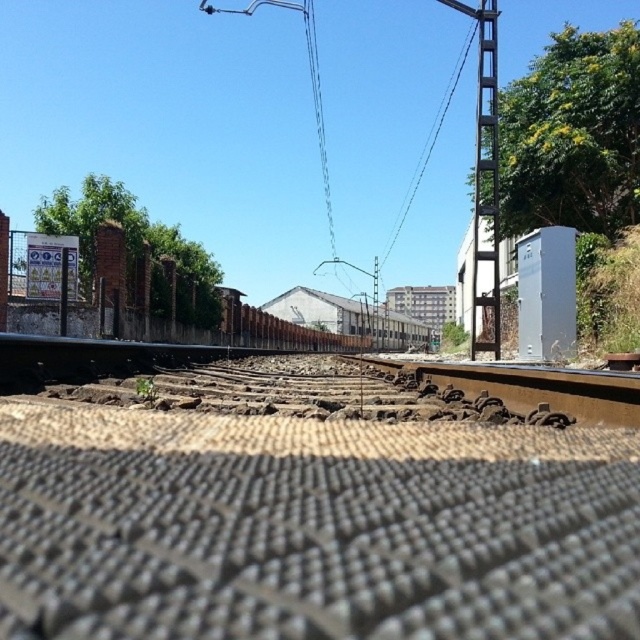
Looking at this image, which is above, gray textured gravel at center or metallic gray train track at center?

gray textured gravel at center is higher up.

Does gray textured gravel at center appear on the left side of metallic gray train track at center?

Indeed, gray textured gravel at center is positioned on the left side of metallic gray train track at center.

At what (x,y) coordinates should I click in order to perform the action: click on gray textured gravel at center. Please return your answer as a coordinate pair (x, y). Looking at the image, I should click on [x=321, y=502].